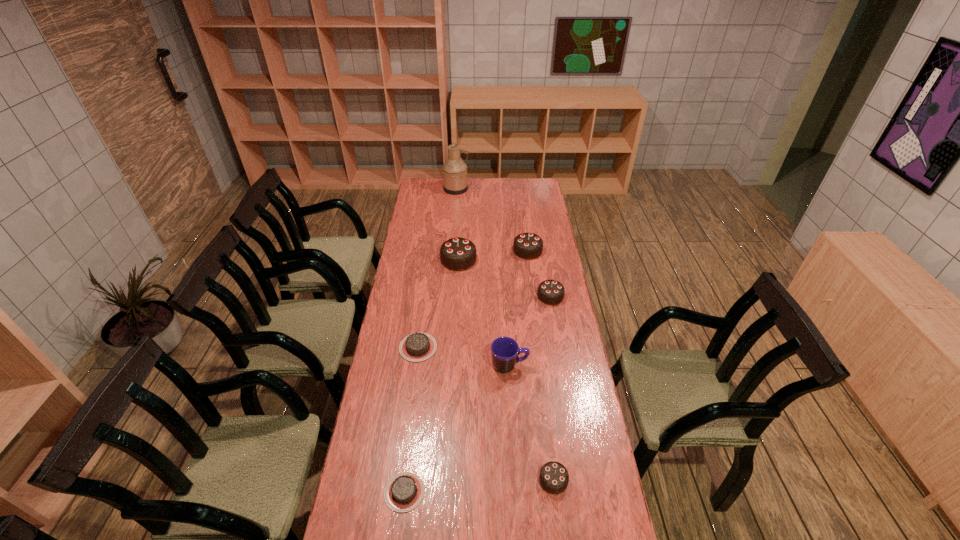
Select which chocolate chocolate cake is the closest to the biggest chocolate chocolate cake. Please provide its 2D coordinates. Your answer should be formatted as a tuple, i.e. [(x, y)], where the tuple contains the x and y coordinates of a point satisfying the conditions above.

[(528, 246)]

Find the location of a particular element. This screenshot has height=540, width=960. the closest brown chocolate cake to the black mug is located at coordinates [416, 347].

At what (x,y) coordinates should I click in order to perform the action: click on free space that satisfies the following two spatial constraints: 1. on the front side of the fifth shortest chocolate cake; 2. with the handle on the side of the black mug. Please return your answer as a coordinate pair (x, y). Looking at the image, I should click on (543, 366).

Identify the location of vacant region that satisfies the following two spatial constraints: 1. on the back side of the smaller brown chocolate cake; 2. on the right side of the third farthest chocolate cake. (429, 296).

This screenshot has width=960, height=540. What are the coordinates of `vacant space that satisfies the following two spatial constraints: 1. on the front side of the third farthest chocolate chocolate cake; 2. on the left side of the third smallest chocolate chocolate cake` in the screenshot? It's located at (534, 296).